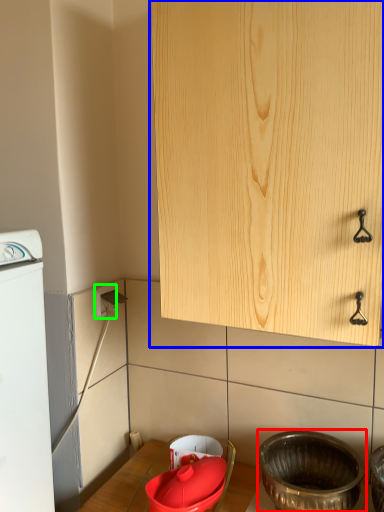
Question: Which is nearer to the basin (highlighted by a red box)? cabinetry (highlighted by a blue box) or electric outlet (highlighted by a green box).

Choices:
 (A) cabinetry
 (B) electric outlet

Answer: (A)